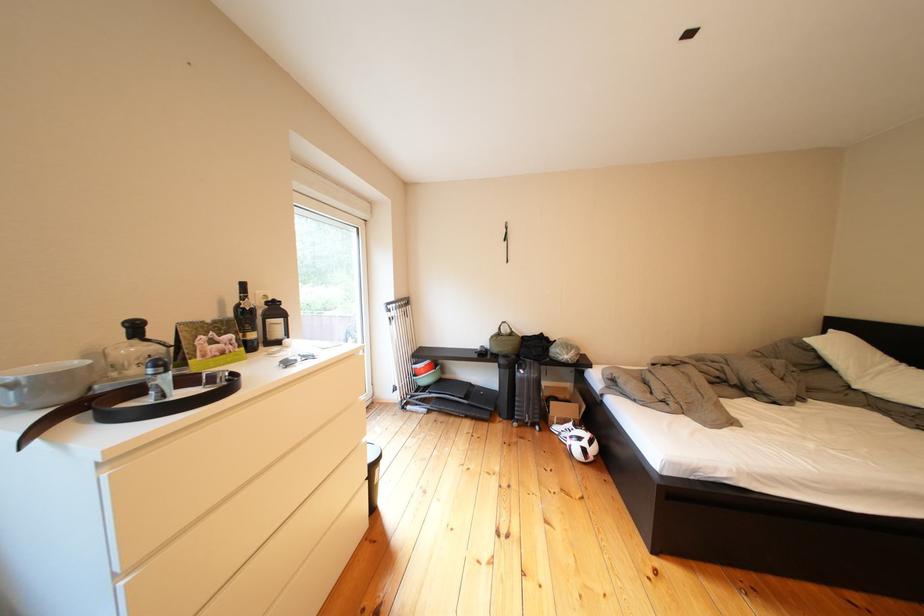
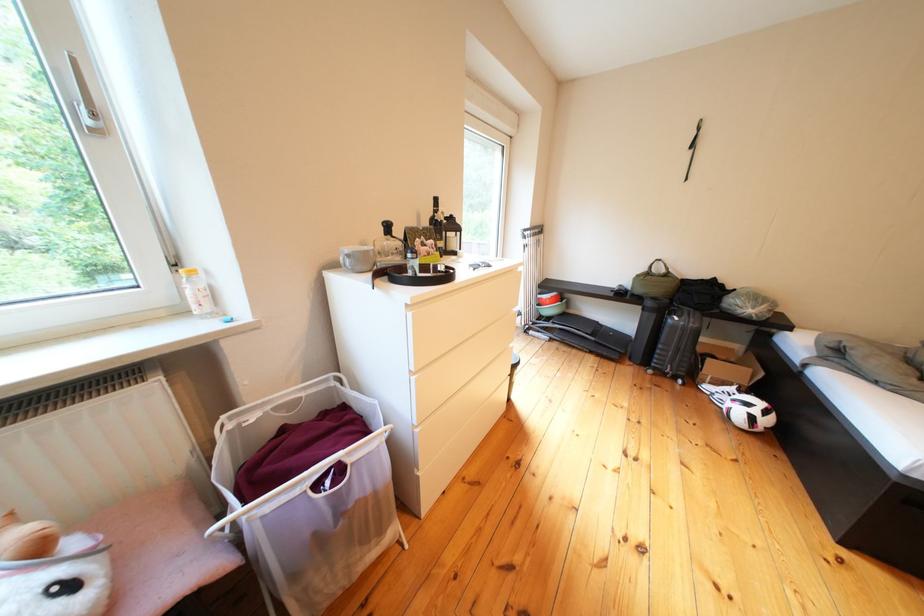
Which direction would the cameraman need to move to produce the second image?

The cameraman moved toward left, backward.